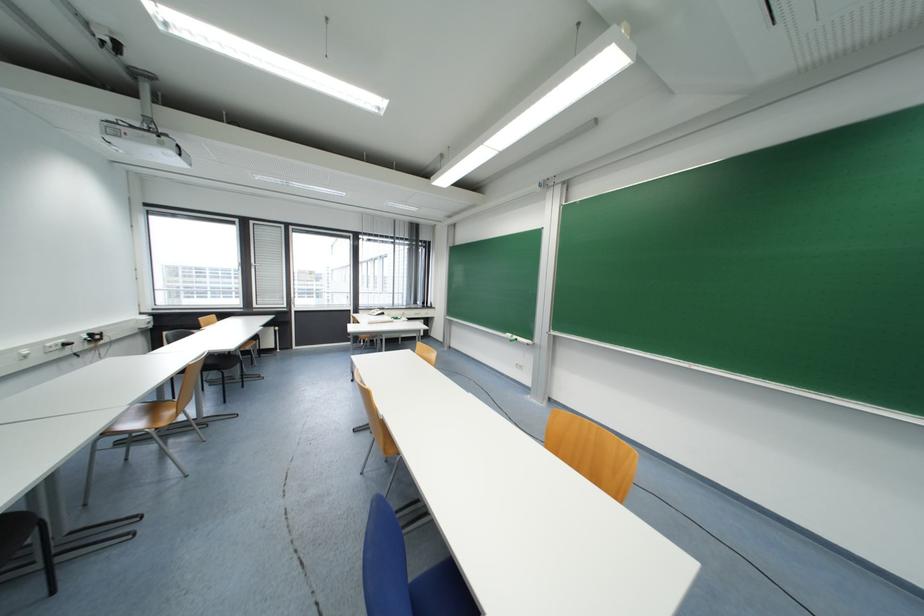
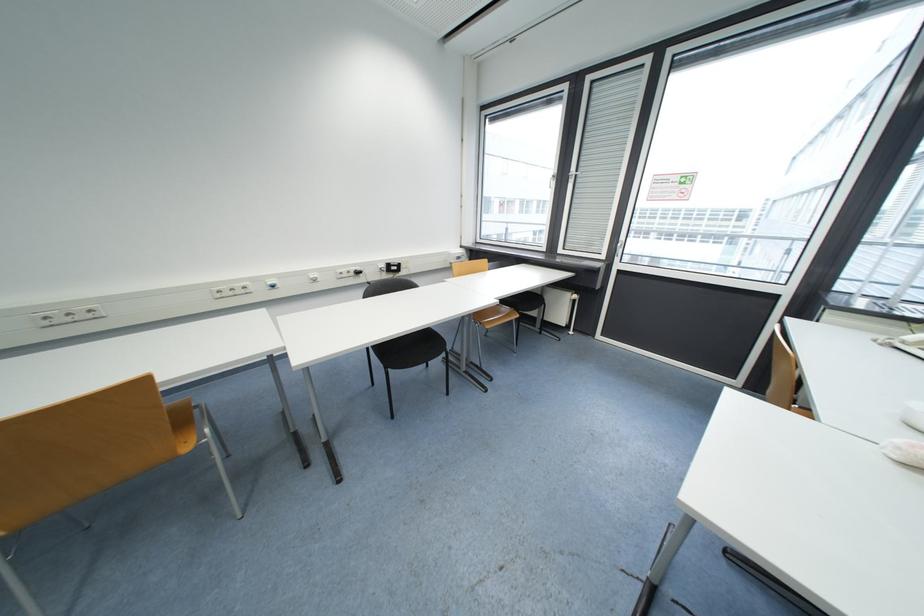
Locate, in the second image, the point that corresponds to [257,224] in the first image.

(593, 81)